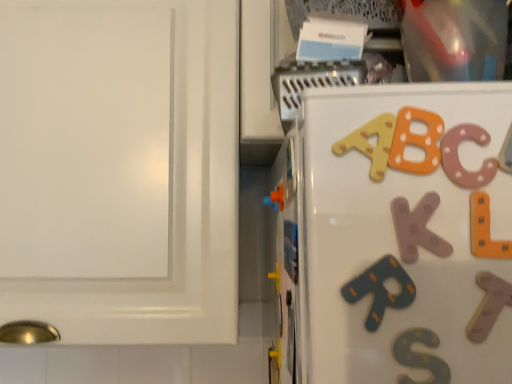
Describe the element at coordinates (275, 199) in the screenshot. I see `orange matte toy at center` at that location.

Measure the distance between orange matte toy at center and camera.

orange matte toy at center is 18.83 inches from camera.

The image size is (512, 384). Describe the element at coordinates (120, 169) in the screenshot. I see `white glossy cabinet at upper right` at that location.

Measure the distance between point (35,226) and camera.

Point (35,226) is 23.98 inches from camera.

Find the location of a particular element. orange matte magnet at center is located at coordinates (291, 249).

Describe the element at coordinates (291, 249) in the screenshot. I see `orange matte magnet at center` at that location.

This screenshot has width=512, height=384. In order to click on orange matte toy at center in this screenshot , I will do [x=275, y=199].

Consider the image. Which is in front, orange matte toy at center or white glossy cabinet at upper right?

orange matte toy at center.

Looking at their sizes, would you say orange matte toy at center is wider or thinner than white glossy cabinet at upper right?

Considering their sizes, orange matte toy at center looks slimmer than white glossy cabinet at upper right.

Is orange matte toy at center in contact with white glossy cabinet at upper right?

No, orange matte toy at center is not next to white glossy cabinet at upper right.

The image size is (512, 384). Identify the location of toy that appears below the white glossy cabinet at upper right (from a real-world perspective). (275, 199).

Is point (295, 282) positioned before point (222, 85)?

Yes, it is in front of point (222, 85).

Where is `cabinetry located above the orange matte magnet at center (from the image's perspective)`? The width and height of the screenshot is (512, 384). cabinetry located above the orange matte magnet at center (from the image's perspective) is located at coordinates (120, 169).

Is orange matte magnet at center not close to white glossy cabinet at upper right?

No, there isn't a large distance between orange matte magnet at center and white glossy cabinet at upper right.

Looking at this image, from the image's perspective, is orange matte magnet at center above white glossy cabinet at upper right?

No.

Can you confirm if orange matte toy at center is bigger than orange matte magnet at center?

No.

From a real-world perspective, is orange matte toy at center on top of orange matte magnet at center?

Yes, from a real-world perspective, orange matte toy at center is on top of orange matte magnet at center.

Is orange matte toy at center turned away from orange matte magnet at center?

No, orange matte magnet at center is not at the back of orange matte toy at center.

From the image's perspective, which is below, orange matte toy at center or orange matte magnet at center?

From the image's view, orange matte magnet at center is below.

Is white glossy cabinet at upper right looking in the opposite direction of orange matte toy at center?

white glossy cabinet at upper right is not turned away from orange matte toy at center.

Which object is closer to the camera taking this photo, white glossy cabinet at upper right or orange matte toy at center?

Positioned in front is orange matte toy at center.

Between white glossy cabinet at upper right and orange matte toy at center, which one has less height?

Standing shorter between the two is orange matte toy at center.

Is white glossy cabinet at upper right with orange matte magnet at center?

No, white glossy cabinet at upper right is not making contact with orange matte magnet at center.

Looking at this image, based on their positions, is white glossy cabinet at upper right located to the left or right of orange matte magnet at center?

Based on their positions, white glossy cabinet at upper right is located to the left of orange matte magnet at center.

How distant is white glossy cabinet at upper right from orange matte magnet at center?

white glossy cabinet at upper right is 12.72 inches away from orange matte magnet at center.

Considering the positions of objects orange matte magnet at center and orange matte toy at center in the image provided, who is more to the right, orange matte magnet at center or orange matte toy at center?

orange matte magnet at center.

Is orange matte magnet at center completely or partially outside of orange matte toy at center?

Yes, orange matte magnet at center is located beyond the bounds of orange matte toy at center.

Who is bigger, orange matte magnet at center or orange matte toy at center?

Bigger between the two is orange matte magnet at center.

The width and height of the screenshot is (512, 384). In the image, there is a orange matte toy at center. Find the location of `magnet below it (from the image's perspective)`. magnet below it (from the image's perspective) is located at coordinates (291, 249).

The height and width of the screenshot is (384, 512). In order to click on toy on the right side of white glossy cabinet at upper right in this screenshot , I will do `click(275, 199)`.

Locate an element on the screen. The image size is (512, 384). cabinetry lying behind the orange matte magnet at center is located at coordinates (120, 169).

Looking at the image, which one is located closer to orange matte magnet at center, white glossy cabinet at upper right or orange matte toy at center?

orange matte toy at center lies closer to orange matte magnet at center than the other object.

Based on their spatial positions, is orange matte toy at center or white glossy cabinet at upper right closer to orange matte magnet at center?

orange matte toy at center.

Considering their positions, is white glossy cabinet at upper right positioned closer to orange matte toy at center than orange matte magnet at center?

Among the two, orange matte magnet at center is located nearer to orange matte toy at center.

Based on their spatial positions, is orange matte toy at center or orange matte magnet at center further from white glossy cabinet at upper right?

Among the two, orange matte magnet at center is located further to white glossy cabinet at upper right.

When comparing their distances from white glossy cabinet at upper right, does orange matte magnet at center or orange matte toy at center seem further?

orange matte magnet at center lies further to white glossy cabinet at upper right than the other object.

Which object lies further to the anchor point orange matte toy at center, orange matte magnet at center or white glossy cabinet at upper right?

white glossy cabinet at upper right is positioned further to the anchor orange matte toy at center.

What are the coordinates of `toy located between white glossy cabinet at upper right and orange matte magnet at center in the left-right direction` in the screenshot? It's located at (275, 199).